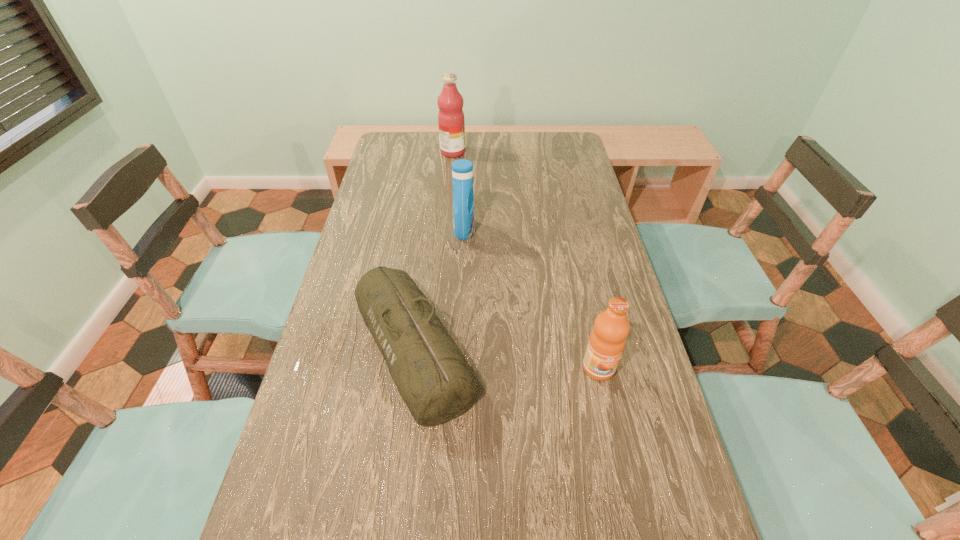
The height and width of the screenshot is (540, 960). Identify the location of free space between the shortest object and the rightmost object. (506, 359).

Where is `blank region between the right fruit juice and the shortest object`? The width and height of the screenshot is (960, 540). blank region between the right fruit juice and the shortest object is located at coordinates (506, 359).

Select which object appears as the second closest to the duffel bag. Please provide its 2D coordinates. Your answer should be formatted as a tuple, i.e. [(x, y)], where the tuple contains the x and y coordinates of a point satisfying the conditions above.

[(607, 340)]

Find the location of a particular element. The image size is (960, 540). the second closest object to the tallest object is located at coordinates (436, 383).